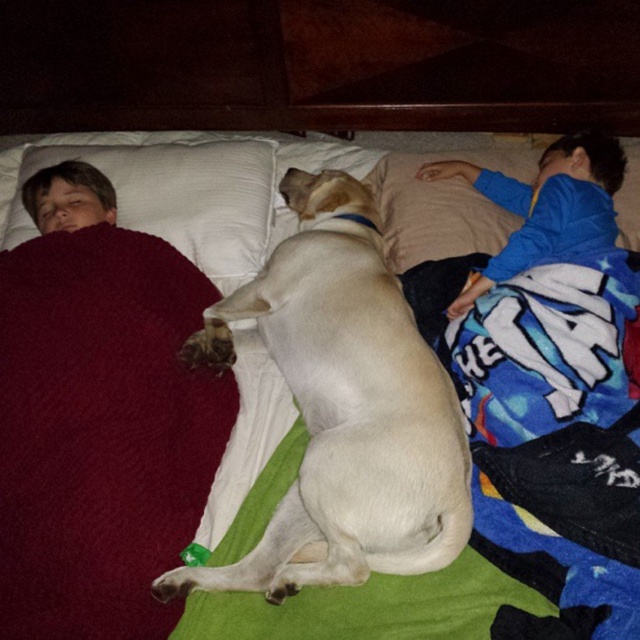
Between white soft pillow at upper left and blue fleece blanket at right, which one appears on the left side from the viewer's perspective?

white soft pillow at upper left is more to the left.

Which is in front, point (156, 154) or point (596, 147)?

Positioned in front is point (596, 147).

Image resolution: width=640 pixels, height=640 pixels. I want to click on white soft pillow at upper left, so click(x=177, y=198).

Is the position of white smooth dog at center more distant than that of white soft pillow at upper left?

No, white smooth dog at center is in front of white soft pillow at upper left.

Who is higher up, white smooth dog at center or white soft pillow at upper left?

Positioned higher is white soft pillow at upper left.

Locate an element on the screen. white smooth dog at center is located at coordinates (342, 406).

Consider the image. Who is taller, white smooth dog at center or blue fleece blanket at right?

white smooth dog at center is taller.

Who is positioned more to the left, white smooth dog at center or blue fleece blanket at right?

white smooth dog at center

Where is `white smooth dog at center`? white smooth dog at center is located at coordinates (342, 406).